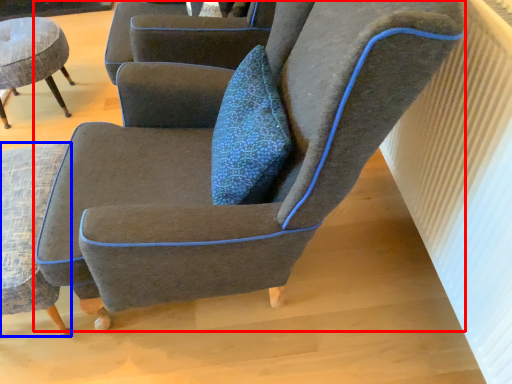
Question: Which point is closer to the camera, chair (highlighted by a red box) or chair (highlighted by a blue box)?

Choices:
 (A) chair
 (B) chair

Answer: (A)